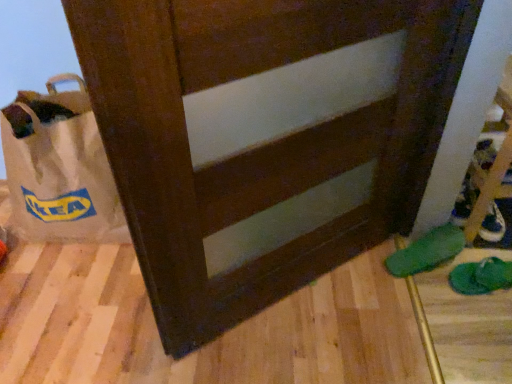
Question: Can you confirm if green fabric slipper at lower right, acting as the second footwear starting from the left, is positioned to the right of green fabric slipper at lower right, the second footwear from the right?

Choices:
 (A) no
 (B) yes

Answer: (B)

Question: Is green fabric slipper at lower right, positioned as the 1th footwear in right-to-left order, to the left of green fabric slipper at lower right, the second footwear from the right, from the viewer's perspective?

Choices:
 (A) no
 (B) yes

Answer: (A)

Question: Can we say green fabric slipper at lower right, positioned as the 1th footwear in right-to-left order, lies outside green fabric slipper at lower right, which is counted as the first footwear, starting from the left?

Choices:
 (A) no
 (B) yes

Answer: (B)

Question: Can you confirm if green fabric slipper at lower right, positioned as the 1th footwear in right-to-left order, is taller than green fabric slipper at lower right, the second footwear from the right?

Choices:
 (A) yes
 (B) no

Answer: (B)

Question: Can you confirm if green fabric slipper at lower right, acting as the second footwear starting from the left, is wider than green fabric slipper at lower right, which is counted as the first footwear, starting from the left?

Choices:
 (A) no
 (B) yes

Answer: (A)

Question: Based on their sizes in the image, would you say white leather shoe at lower right is bigger or smaller than green fabric slipper at lower right, which is counted as the first footwear, starting from the left?

Choices:
 (A) small
 (B) big

Answer: (A)

Question: Considering the positions of white leather shoe at lower right and green fabric slipper at lower right, which is counted as the first footwear, starting from the left, in the image, is white leather shoe at lower right taller or shorter than green fabric slipper at lower right, which is counted as the first footwear, starting from the left,?

Choices:
 (A) tall
 (B) short

Answer: (B)

Question: Is point coord(489,208) positioned closer to the camera than point coord(440,249)?

Choices:
 (A) closer
 (B) farther

Answer: (B)

Question: Considering the positions of white leather shoe at lower right and green fabric slipper at lower right, which is counted as the first footwear, starting from the left, in the image, is white leather shoe at lower right wider or thinner than green fabric slipper at lower right, which is counted as the first footwear, starting from the left,?

Choices:
 (A) thin
 (B) wide

Answer: (A)

Question: From the image's perspective, relative to white paper bag at left, is green fabric slipper at lower right, the second footwear from the right, above or below?

Choices:
 (A) below
 (B) above

Answer: (A)

Question: Is green fabric slipper at lower right, the second footwear from the right, in front of or behind white paper bag at left in the image?

Choices:
 (A) front
 (B) behind

Answer: (B)

Question: Visually, is green fabric slipper at lower right, the second footwear from the right, positioned to the left or to the right of white paper bag at left?

Choices:
 (A) right
 (B) left

Answer: (A)

Question: Does point (462, 241) appear closer or farther from the camera than point (74, 110)?

Choices:
 (A) closer
 (B) farther

Answer: (A)

Question: Choose the correct answer: Is green fabric slipper at lower right, which is counted as the first footwear, starting from the left, inside green fabric slipper at lower right, positioned as the 1th footwear in right-to-left order, or outside it?

Choices:
 (A) outside
 (B) inside

Answer: (A)

Question: In the image, is green fabric slipper at lower right, the second footwear from the right, positioned in front of or behind green fabric slipper at lower right, acting as the second footwear starting from the left?

Choices:
 (A) front
 (B) behind

Answer: (B)